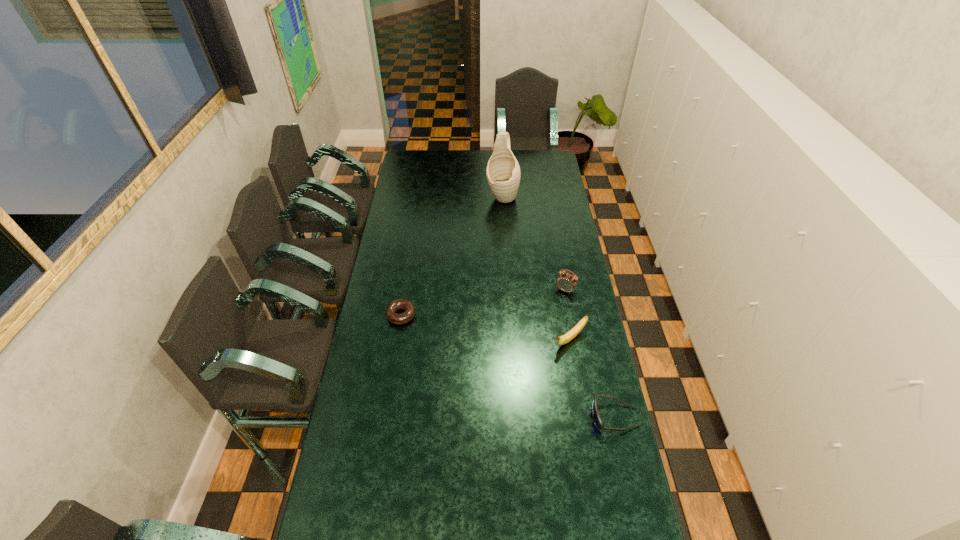
Locate an element on the screen. The image size is (960, 540). vacant space located 0.090m on the right of the doughnut is located at coordinates (438, 315).

Where is `vacant space situated 0.170m on the front-facing side of the sunglasses`? vacant space situated 0.170m on the front-facing side of the sunglasses is located at coordinates (540, 417).

This screenshot has width=960, height=540. Identify the location of vacant space situated on the front-facing side of the sunglasses. (529, 417).

Identify the location of free space located on the front-facing side of the sunglasses. tap(532, 417).

Image resolution: width=960 pixels, height=540 pixels. Identify the location of vacant space situated 0.250m on the face of the alarm clock. (536, 336).

At what (x,y) coordinates should I click in order to perform the action: click on vacant area situated 0.110m on the face of the alarm clock. Please return your answer as a coordinate pair (x, y). This screenshot has height=540, width=960. Looking at the image, I should click on (550, 312).

This screenshot has width=960, height=540. In order to click on free space located 0.290m on the face of the alarm clock in this screenshot , I will do `click(532, 343)`.

Where is `free space located at the spout of the tallest object`? This screenshot has height=540, width=960. free space located at the spout of the tallest object is located at coordinates 495,241.

Locate an element on the screen. The image size is (960, 540). free space located 0.260m at the spout of the tallest object is located at coordinates (495, 241).

I want to click on vacant region located 0.380m at the spout of the tallest object, so click(492, 258).